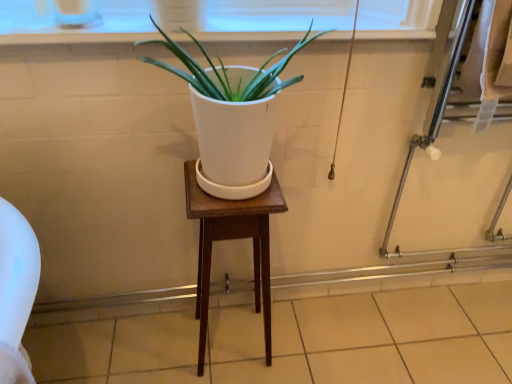
Where is `vacant space that is to the left of wooden stool at center`? vacant space that is to the left of wooden stool at center is located at coordinates (163, 354).